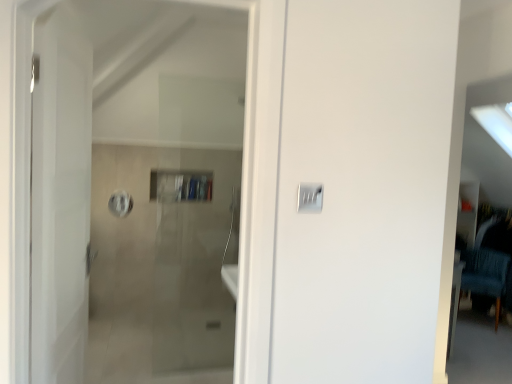
Question: From a real-world perspective, is satin silver switch at center over white glossy door at left?

Choices:
 (A) yes
 (B) no

Answer: (A)

Question: From a real-world perspective, does satin silver switch at center sit lower than white glossy door at left?

Choices:
 (A) no
 (B) yes

Answer: (A)

Question: Does satin silver switch at center have a lesser height compared to white glossy door at left?

Choices:
 (A) no
 (B) yes

Answer: (B)

Question: From the image's perspective, would you say satin silver switch at center is positioned over white glossy door at left?

Choices:
 (A) yes
 (B) no

Answer: (A)

Question: Is satin silver switch at center outside of white glossy door at left?

Choices:
 (A) yes
 (B) no

Answer: (A)

Question: Based on their sizes in the image, would you say white glossy door at left is bigger or smaller than blue fabric chair at right?

Choices:
 (A) big
 (B) small

Answer: (B)

Question: From a real-world perspective, is white glossy door at left positioned above or below blue fabric chair at right?

Choices:
 (A) below
 (B) above

Answer: (B)

Question: Considering the positions of white glossy door at left and blue fabric chair at right in the image, is white glossy door at left wider or thinner than blue fabric chair at right?

Choices:
 (A) wide
 (B) thin

Answer: (B)

Question: Is white glossy door at left taller or shorter than blue fabric chair at right?

Choices:
 (A) short
 (B) tall

Answer: (B)

Question: Considering the positions of point (471, 289) and point (74, 233), is point (471, 289) closer or farther from the camera than point (74, 233)?

Choices:
 (A) farther
 (B) closer

Answer: (A)

Question: Which is correct: blue fabric chair at right is inside white glossy door at left, or outside of it?

Choices:
 (A) outside
 (B) inside

Answer: (A)

Question: From a real-world perspective, is blue fabric chair at right above or below white glossy door at left?

Choices:
 (A) below
 (B) above

Answer: (A)

Question: Relative to white glossy door at left, is blue fabric chair at right in front or behind?

Choices:
 (A) behind
 (B) front

Answer: (A)

Question: Considering their positions, is white glossy door at left located in front of or behind satin silver switch at center?

Choices:
 (A) front
 (B) behind

Answer: (A)

Question: From their relative heights in the image, would you say white glossy door at left is taller or shorter than satin silver switch at center?

Choices:
 (A) short
 (B) tall

Answer: (B)